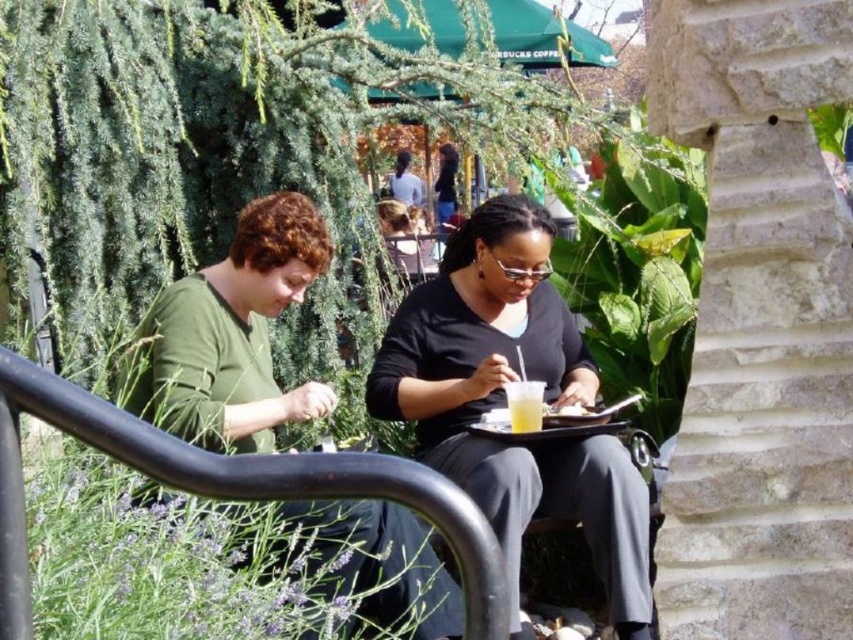
You are a photographer taking a photo of the black matte shirt at center and the translucent plastic cup at center. Based on their positions, which object will appear larger in the photo?

The black matte shirt at center will appear larger in the photo because it is taller than the translucent plastic cup at center.

You are standing at the point labeled as point (537, 394) and want to join the two people sitting on the stone bench. Can you estimate whether you can walk directly between them without needing to move either of them?

The two people are 10.81 feet apart, so there is enough space for you to walk directly between them without needing to move either of them.

You are standing in front of the two people sitting on the stone bench. You want to place a small gift between them. Which point, point (x=531, y=417) or point (x=445, y=188), is closer to you and better suited for placing the gift?

Point (x=531, y=417) is closer to the viewer than point (x=445, y=188), so it is better suited for placing the gift as it is nearer to you.